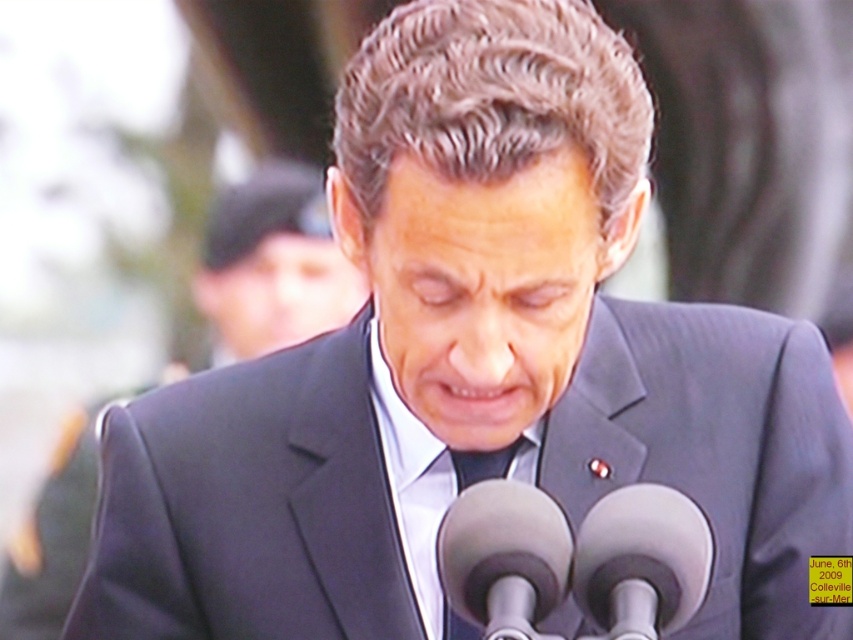
Who is lower down, gray metallic microphone at center or smooth gray microphone at center?

gray metallic microphone at center is lower down.

Does point (635, 515) lie behind point (505, 625)?

Yes, point (635, 515) is farther from viewer.

The width and height of the screenshot is (853, 640). What are the coordinates of `gray metallic microphone at center` in the screenshot? It's located at (641, 561).

Is point (74, 456) in front of point (451, 604)?

No, it is not.

Does black matte suit at center appear on the left side of smooth gray microphone at center?

Indeed, black matte suit at center is positioned on the left side of smooth gray microphone at center.

Does point (41, 541) lie behind point (490, 508)?

That is True.

The height and width of the screenshot is (640, 853). Find the location of `black matte suit at center`. black matte suit at center is located at coordinates (273, 262).

Looking at this image, is black matte suit at center positioned behind gray metallic microphone at center?

Yes, it is.

Can you confirm if black matte suit at center is shorter than gray metallic microphone at center?

Incorrect, black matte suit at center's height does not fall short of gray metallic microphone at center's.

Is point (54, 556) closer to viewer compared to point (608, 529)?

That is False.

Find the location of a particular element. black matte suit at center is located at coordinates (273, 262).